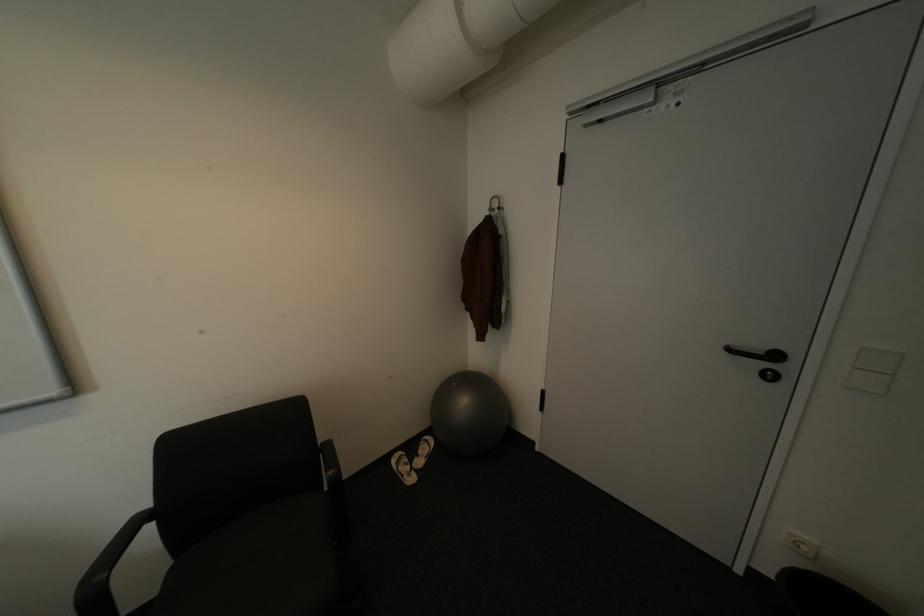
This screenshot has height=616, width=924. What do you see at coordinates (257, 565) in the screenshot? I see `the chair sitting surface` at bounding box center [257, 565].